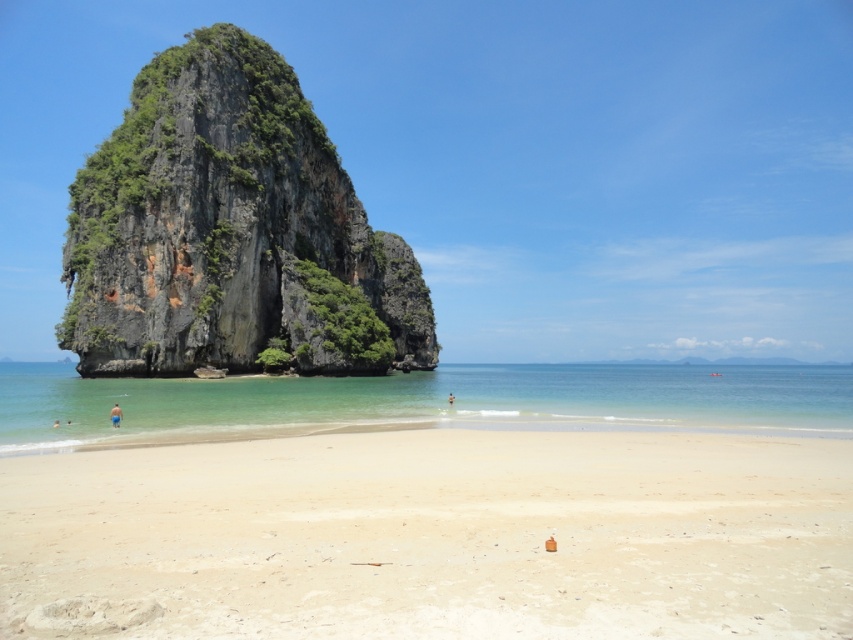
You are a photographer planning to capture a wide shot of the beach scene. You want to ensure both the green mossy rock at center and the blue fabric shorts at lower left are fully visible in the frame. Based on their sizes, which object would require more horizontal space in the photo composition?

The green mossy rock at center requires more horizontal space in the photo composition because its width surpasses that of the blue fabric shorts at lower left.

You are planning to build a small sandcastle on the beach. Given the light beige sand at center and the clear blue water at center, which area would be more suitable for building the sandcastle without it being immediately washed away by the water?

The light beige sand at center is more suitable for building the sandcastle because its width is less than the clear blue water at center, meaning the water is wider and might reach further inland, making the sand area narrower and potentially more vulnerable to being washed away.

You are standing on the beach and want to place a 2.5 meter long kayak on the light beige sand at center. Can you fit the kayak horizontally on the sand without overlapping any other objects?

The light beige sand at center is 10.45 meters away from viewer. The distance is sufficient to place a 2.5 meter long kayak horizontally as there is enough space available on the sand.